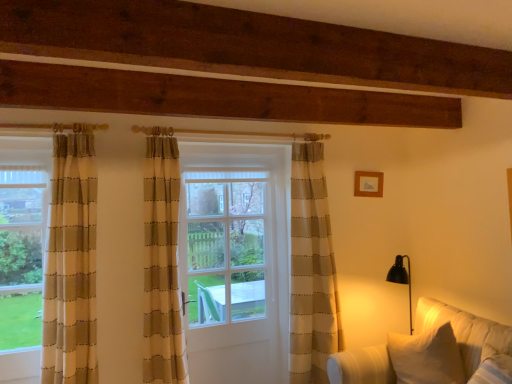
At what (x,y) coordinates should I click in order to perform the action: click on blank space above clear glass door at center (from a real-world perspective). Please return your answer as a coordinate pair (x, y). This screenshot has width=512, height=384. Looking at the image, I should click on (223, 158).